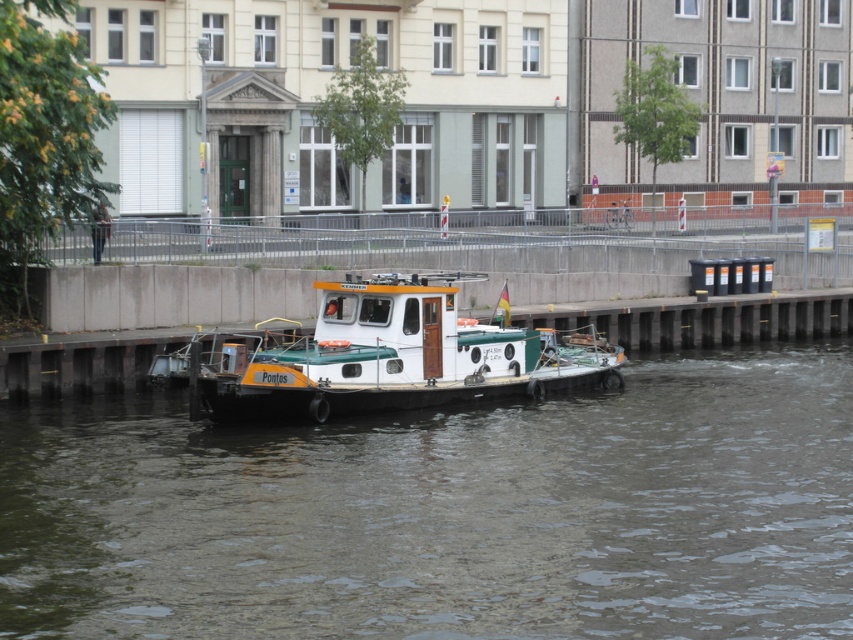
Question: Is the position of greenish-gray water at center less distant than that of white matte boat at center?

Choices:
 (A) yes
 (B) no

Answer: (A)

Question: Which object appears closest to the camera in this image?

Choices:
 (A) white matte boat at center
 (B) greenish-gray water at center

Answer: (B)

Question: Which point is closer to the camera?

Choices:
 (A) greenish-gray water at center
 (B) white matte boat at center

Answer: (A)

Question: Does greenish-gray water at center have a larger size compared to white matte boat at center?

Choices:
 (A) no
 (B) yes

Answer: (B)

Question: Can you confirm if greenish-gray water at center is wider than white matte boat at center?

Choices:
 (A) yes
 (B) no

Answer: (A)

Question: Which point appears closest to the camera in this image?

Choices:
 (A) 294,557
 (B) 538,392

Answer: (A)